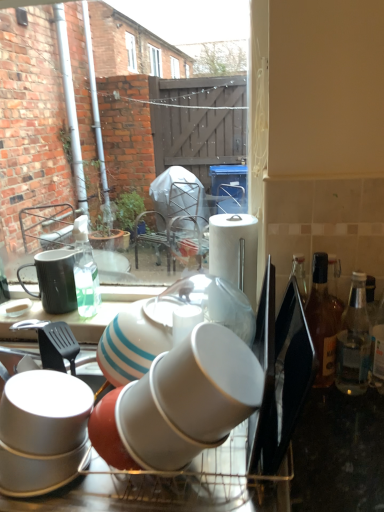
Question: Is clear glass bottle at right, the first bottle in the right-to-left sequence, not inside white glossy cup at center, placed as the 2th tableware when sorted from left to right?

Choices:
 (A) no
 (B) yes

Answer: (B)

Question: Could white glossy cup at center, the second tableware in the back-to-front sequence, be considered to be inside clear glass bottle at right, the first bottle in the right-to-left sequence?

Choices:
 (A) no
 (B) yes

Answer: (A)

Question: From the image's perspective, is clear glass bottle at right, which is the second bottle in left-to-right order, on top of white glossy cup at center, the 1th tableware viewed from the front?

Choices:
 (A) yes
 (B) no

Answer: (A)

Question: From a real-world perspective, is clear glass bottle at right, which is the second bottle in left-to-right order, located higher than white glossy cup at center, the 1th tableware viewed from the front?

Choices:
 (A) no
 (B) yes

Answer: (B)

Question: From a real-world perspective, does clear glass bottle at right, which is the second bottle in left-to-right order, sit lower than white glossy cup at center, placed as the 2th tableware when sorted from left to right?

Choices:
 (A) no
 (B) yes

Answer: (A)

Question: In terms of width, does white glossy cups at center look wider or thinner when compared to clear glass bottle at right, which is the second bottle in left-to-right order?

Choices:
 (A) thin
 (B) wide

Answer: (B)

Question: In terms of height, does white glossy cups at center look taller or shorter compared to clear glass bottle at right, the first bottle in the right-to-left sequence?

Choices:
 (A) tall
 (B) short

Answer: (A)

Question: Is white glossy cups at center inside or outside of clear glass bottle at right, the first bottle in the right-to-left sequence?

Choices:
 (A) inside
 (B) outside

Answer: (B)

Question: Is white glossy cups at center bigger or smaller than clear glass bottle at right, which is the second bottle in left-to-right order?

Choices:
 (A) small
 (B) big

Answer: (B)

Question: Considering their positions, is clear glass bottle at right, which is the second bottle in left-to-right order, located in front of or behind translucent glass bottle at right, placed as the first bottle when sorted from left to right?

Choices:
 (A) front
 (B) behind

Answer: (A)

Question: Choose the correct answer: Is clear glass bottle at right, which is the second bottle in left-to-right order, inside translucent glass bottle at right, positioned as the 2th bottle in right-to-left order, or outside it?

Choices:
 (A) outside
 (B) inside

Answer: (A)

Question: From the image's perspective, relative to translucent glass bottle at right, positioned as the 2th bottle in right-to-left order, is clear glass bottle at right, the first bottle in the right-to-left sequence, above or below?

Choices:
 (A) below
 (B) above

Answer: (A)

Question: From a real-world perspective, is clear glass bottle at right, the first bottle in the right-to-left sequence, positioned above or below translucent glass bottle at right, placed as the first bottle when sorted from left to right?

Choices:
 (A) below
 (B) above

Answer: (A)

Question: In terms of width, does white glossy cup at center, the 1th tableware viewed from the front, look wider or thinner when compared to white glossy cups at center?

Choices:
 (A) wide
 (B) thin

Answer: (B)

Question: In the image, is white glossy cup at center, placed as the 2th tableware when sorted from left to right, positioned in front of or behind white glossy cups at center?

Choices:
 (A) behind
 (B) front

Answer: (A)